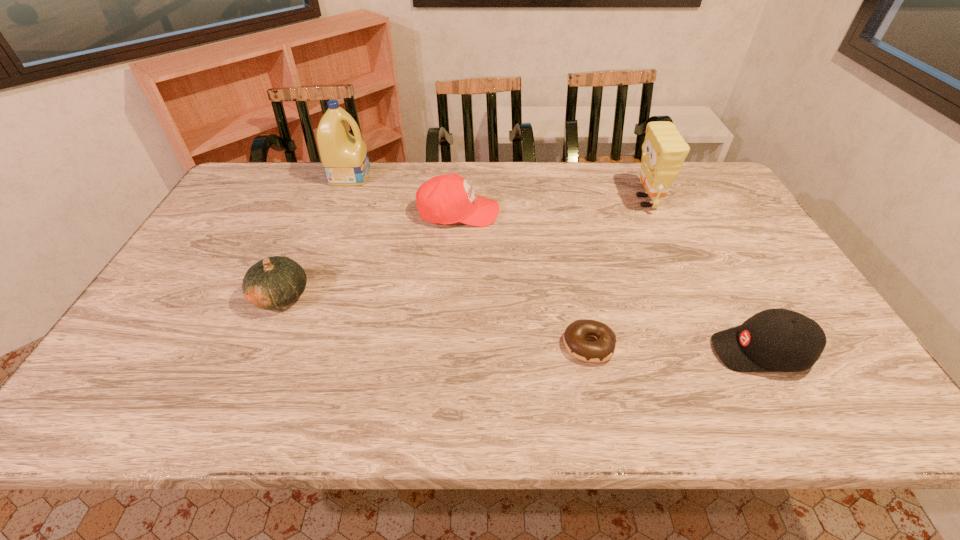
Identify the location of sponge that is positioned at the far edge. (664, 150).

Identify the location of baseball cap located at the far edge. (446, 199).

At what (x,y) coordinates should I click in order to perform the action: click on object positioned at the right edge. Please return your answer as a coordinate pair (x, y). Looking at the image, I should click on 775,340.

What are the coordinates of `vacant region at the far edge of the desktop` in the screenshot? It's located at (586, 199).

At what (x,y) coordinates should I click in order to perform the action: click on vacant area at the near edge. Please return your answer as a coordinate pair (x, y). This screenshot has width=960, height=540. Looking at the image, I should click on (480, 393).

Image resolution: width=960 pixels, height=540 pixels. Identify the location of vacant space at the left edge. (228, 204).

Where is `free spot at the right edge of the desktop`? Image resolution: width=960 pixels, height=540 pixels. free spot at the right edge of the desktop is located at coordinates (740, 286).

Image resolution: width=960 pixels, height=540 pixels. I want to click on free spot at the far left corner of the desktop, so click(280, 164).

Where is `vacant space at the far right corner of the desktop`? vacant space at the far right corner of the desktop is located at coordinates (714, 180).

This screenshot has height=540, width=960. I want to click on vacant space that's between the doughnut and the gourd, so click(435, 320).